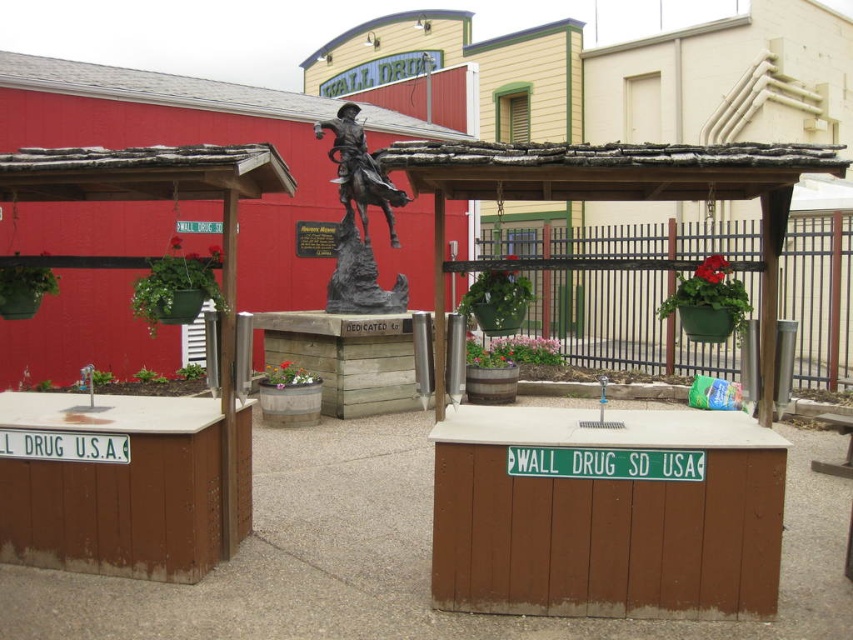
Question: Does green metal fence at center have a lesser width compared to bronze statue at center?

Choices:
 (A) no
 (B) yes

Answer: (B)

Question: Among these points, which one is farthest from the camera?

Choices:
 (A) (x=525, y=257)
 (B) (x=334, y=179)

Answer: (A)

Question: Among these objects, which one is farthest from the camera?

Choices:
 (A) green metal fence at center
 (B) bronze statue at center

Answer: (A)

Question: Does green metal fence at center have a lesser width compared to bronze statue at center?

Choices:
 (A) yes
 (B) no

Answer: (A)

Question: Does green metal fence at center come behind bronze statue at center?

Choices:
 (A) no
 (B) yes

Answer: (B)